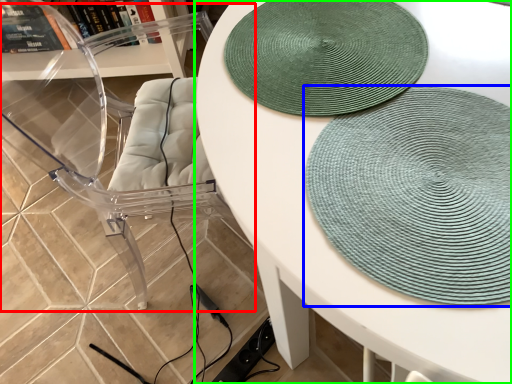
Question: Which object is positioned farthest from swivel chair (highlighted by a red box)? Select from mat (highlighted by a blue box) and table (highlighted by a green box).

Choices:
 (A) mat
 (B) table

Answer: (A)